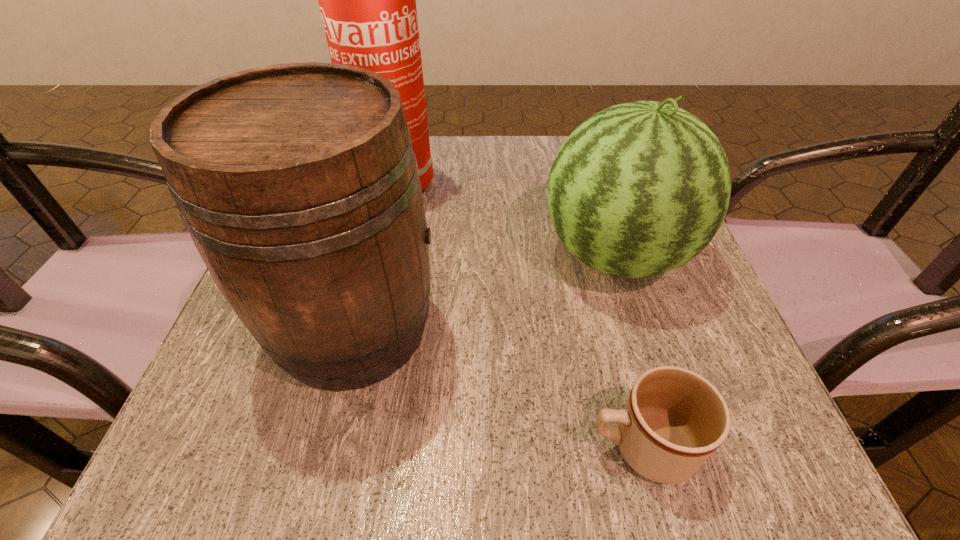
Where is `free spot at the far edge of the desktop`? free spot at the far edge of the desktop is located at coordinates (468, 140).

This screenshot has width=960, height=540. What are the coordinates of `vacant area at the near edge` in the screenshot? It's located at (404, 441).

This screenshot has width=960, height=540. Identify the location of vacant area at the right edge of the desktop. (720, 318).

Image resolution: width=960 pixels, height=540 pixels. Find the location of `free space at the near left corner of the desktop`. free space at the near left corner of the desktop is located at coordinates (180, 485).

At what (x,y) coordinates should I click in order to perform the action: click on free spot at the near right corner of the desktop. Please return your answer as a coordinate pair (x, y). Looking at the image, I should click on (774, 435).

The height and width of the screenshot is (540, 960). I want to click on vacant area that lies between the farthest object and the third tallest object, so click(498, 220).

Image resolution: width=960 pixels, height=540 pixels. I want to click on vacant space in between the second shortest object and the cider, so click(485, 292).

Identify the location of empty space between the cider and the shortest object. The height and width of the screenshot is (540, 960). (497, 387).

I want to click on free space that is in between the third tallest object and the third shortest object, so click(x=485, y=292).

Where is `vacant point located between the third shortest object and the mug`? The width and height of the screenshot is (960, 540). vacant point located between the third shortest object and the mug is located at coordinates (497, 387).